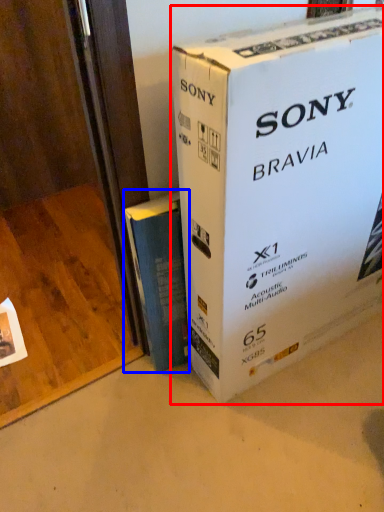
Question: Which of the following is the closest to the observer, box (highlighted by a red box) or book (highlighted by a blue box)?

Choices:
 (A) box
 (B) book

Answer: (A)